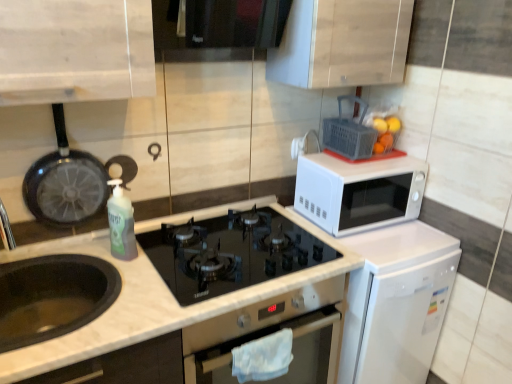
Identify the location of black matte sink at lower left. The image size is (512, 384). (52, 296).

Locate an element on the screen. Image resolution: width=512 pixels, height=384 pixels. translucent plastic basket at upper right is located at coordinates (349, 133).

What do you see at coordinates (271, 333) in the screenshot? The image size is (512, 384). I see `metallic silver oven at center` at bounding box center [271, 333].

Find the location of a particular element. The image size is (512, 384). black matte sink at lower left is located at coordinates point(52,296).

From the image's perspective, which is below, wooden cabinet at upper center or black glass gas stove at center?

black glass gas stove at center, from the image's perspective.

Is wooden cabinet at upper center inside the boundaries of black glass gas stove at center, or outside?

The correct answer is: outside.

Is wooden cabinet at upper center with black glass gas stove at center?

No, wooden cabinet at upper center is not beside black glass gas stove at center.

Can you confirm if wooden cabinet at upper center is wider than black glass gas stove at center?

No.

From the image's perspective, which is below, wooden cabinet at upper center or white plastic electric outlet at upper right?

white plastic electric outlet at upper right is shown below in the image.

From a real-world perspective, is wooden cabinet at upper center below white plastic electric outlet at upper right?

No.

Considering the relative positions of wooden cabinet at upper center and white plastic electric outlet at upper right in the image provided, is wooden cabinet at upper center to the right of white plastic electric outlet at upper right from the viewer's perspective?

Indeed, wooden cabinet at upper center is positioned on the right side of white plastic electric outlet at upper right.

Where is `gas stove beneath the white matte microwave at upper right (from a real-world perspective)`? The image size is (512, 384). gas stove beneath the white matte microwave at upper right (from a real-world perspective) is located at coordinates (230, 252).

Is white matte microwave at upper right thinner than black glass gas stove at center?

Correct, the width of white matte microwave at upper right is less than that of black glass gas stove at center.

Is white matte microwave at upper right facing away from black glass gas stove at center?

white matte microwave at upper right is not turned away from black glass gas stove at center.

Does white matte microwave at upper right contain black glass gas stove at center?

That's incorrect, black glass gas stove at center is not inside white matte microwave at upper right.

Is translucent plastic bottle at center-left smaller than white matte dishwasher at right?

Yes, translucent plastic bottle at center-left is smaller than white matte dishwasher at right.

The image size is (512, 384). Identify the location of bottle that is above the white matte dishwasher at right (from a real-world perspective). (121, 223).

Who is more distant, translucent plastic bottle at center-left or white matte dishwasher at right?

white matte dishwasher at right is behind.

Is white matte dishwasher at right surrounded by translucent plastic bottle at center-left?

No, translucent plastic bottle at center-left does not contain white matte dishwasher at right.

Measure the distance between black matte sink at lower left and wooden cabinet at upper center.

black matte sink at lower left is 1.10 meters away from wooden cabinet at upper center.

Does point (77, 274) lie in front of point (318, 22)?

No, it is not.

Does black matte sink at lower left appear on the left side of wooden cabinet at upper center?

Indeed, black matte sink at lower left is positioned on the left side of wooden cabinet at upper center.

Consider the image. From the image's perspective, would you say black matte sink at lower left is positioned over wooden cabinet at upper center?

Incorrect, from the image's perspective, black matte sink at lower left is lower than wooden cabinet at upper center.

Is metallic silver oven at center shorter than white marble countertop at center?

Yes.

From the image's perspective, is metallic silver oven at center above white marble countertop at center?

Yes.

What are the coordinates of `oven that appears on the right of white marble countertop at center` in the screenshot? It's located at (271, 333).

Can you tell me how much metallic silver oven at center and white marble countertop at center differ in facing direction?

The angular difference between metallic silver oven at center and white marble countertop at center is 3.68e-05 degrees.

Is metallic silver oven at center with white matte dishwasher at right?

metallic silver oven at center is not next to white matte dishwasher at right, and they're not touching.

From their relative heights in the image, would you say metallic silver oven at center is taller or shorter than white matte dishwasher at right?

In the image, metallic silver oven at center appears to be shorter than white matte dishwasher at right.

Is metallic silver oven at center turned away from white matte dishwasher at right?

No, metallic silver oven at center is not facing away from white matte dishwasher at right.

From the image's perspective, is metallic silver oven at center located above white matte dishwasher at right?

Incorrect, from the image's perspective, metallic silver oven at center is lower than white matte dishwasher at right.

Locate an element on the screen. Image resolution: width=512 pixels, height=384 pixels. gas stove on the left of wooden cabinet at upper center is located at coordinates (230, 252).

Find the location of `cabinetry on the right of the white plastic electric outlet at upper right`. cabinetry on the right of the white plastic electric outlet at upper right is located at coordinates pyautogui.click(x=342, y=43).

Estimate the real-world distances between objects in this image. Which object is further from metallic silver oven at center, black glass gas stove at center or white plastic electric outlet at upper right?

Based on the image, white plastic electric outlet at upper right appears to be further to metallic silver oven at center.

From the picture: From the image, which object appears to be farther from white marble countertop at center, black matte frying pan at left or translucent plastic bottle at center-left?

black matte frying pan at left.

Estimate the real-world distances between objects in this image. Which object is closer to black glass gas stove at center, white plastic electric outlet at upper right or translucent plastic basket at upper right?

translucent plastic basket at upper right is closer to black glass gas stove at center.

Considering their positions, is translucent plastic basket at upper right positioned closer to black matte sink at lower left than white matte microwave at upper right?

Based on the image, white matte microwave at upper right appears to be nearer to black matte sink at lower left.

Looking at this image, based on their spatial positions, is wooden cabinet at upper center or translucent plastic basket at upper right further from white matte dishwasher at right?

wooden cabinet at upper center is positioned further to the anchor white matte dishwasher at right.

From the image, which object appears to be nearer to white marble countertop at center, black matte frying pan at left or black matte sink at lower left?

The object closer to white marble countertop at center is black matte sink at lower left.

Which object lies further to the anchor point translucent plastic basket at upper right, white plastic electric outlet at upper right or translucent plastic bottle at center-left?

Based on the image, translucent plastic bottle at center-left appears to be further to translucent plastic basket at upper right.

Considering their positions, is black glass gas stove at center positioned further to translucent plastic basket at upper right than translucent plastic bottle at center-left?

translucent plastic bottle at center-left is positioned further to the anchor translucent plastic basket at upper right.

Locate an element on the screen. This screenshot has width=512, height=384. appliance between black matte frying pan at left and white matte dishwasher at right is located at coordinates click(349, 133).

Where is `oven between black glass gas stove at center and white marble countertop at center in the up-down direction`? oven between black glass gas stove at center and white marble countertop at center in the up-down direction is located at coordinates (271, 333).

The height and width of the screenshot is (384, 512). In order to click on microwave oven located between black glass gas stove at center and white plastic electric outlet at upper right in the depth direction in this screenshot , I will do `click(358, 192)`.

The height and width of the screenshot is (384, 512). In order to click on bottle between black matte frying pan at left and black glass gas stove at center in the horizontal direction in this screenshot , I will do `click(121, 223)`.